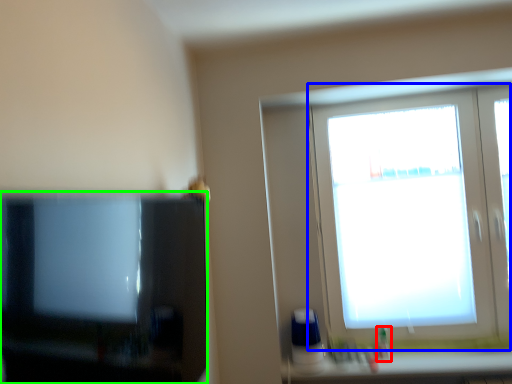
Question: Estimate the real-world distances between objects in this image. Which object is farther from toiletry (highlighted by a red box), window (highlighted by a blue box) or television (highlighted by a green box)?

Choices:
 (A) window
 (B) television

Answer: (B)